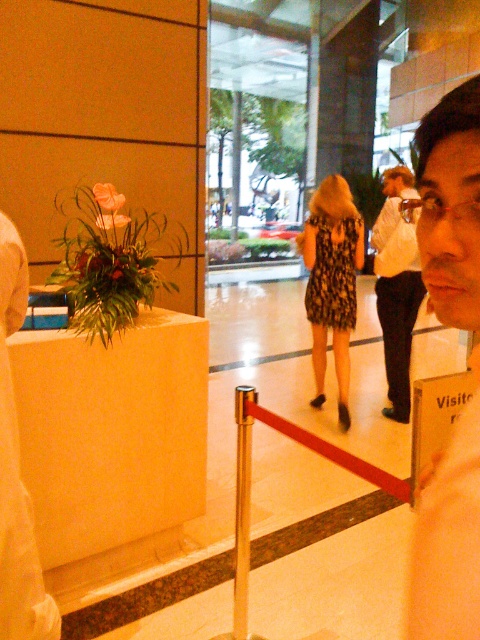
You are standing in the event space and want to take a photo of the matte black face at upper right and the white shirt at center. Which object should you focus on first to ensure both are in clear view?

You should focus on the matte black face at upper right first because it is closer to the viewer than the white shirt at center, so adjusting focus starting from the closer object ensures both are in clear view.

What are the coordinates of the matte black face at upper right?

The coordinates of the matte black face at upper right are at point (448, 536).